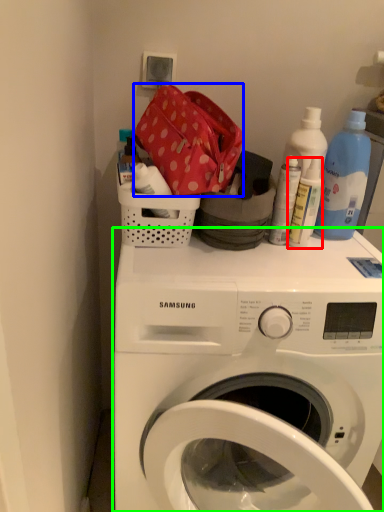
Question: Considering the real-world distances, which object is closest to bottle (highlighted by a red box)? material (highlighted by a blue box) or washing machine (highlighted by a green box).

Choices:
 (A) material
 (B) washing machine

Answer: (A)